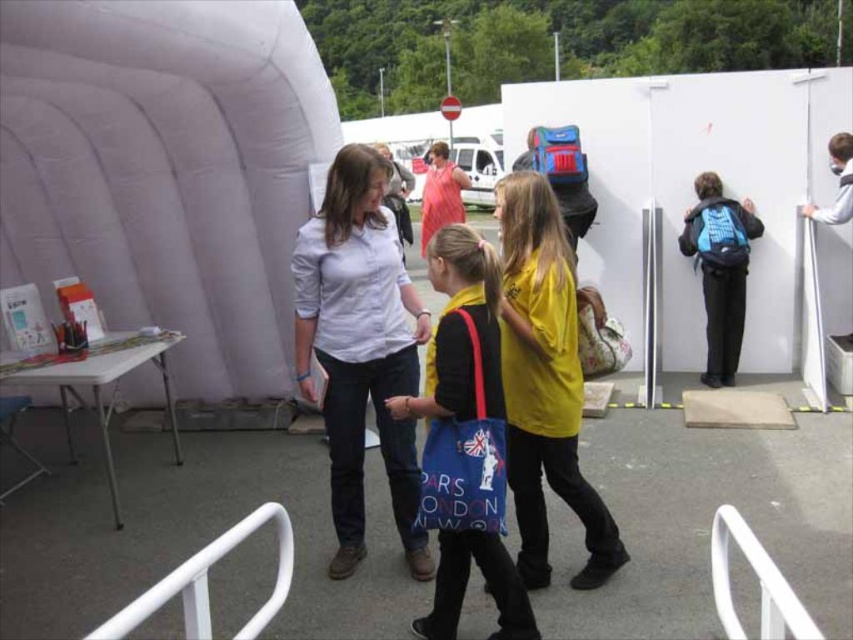
Where is the white cotton shirt at center located in the image?

The white cotton shirt at center is located at point 0.544 in the x coordinate and 0.423 in the y coordinate.